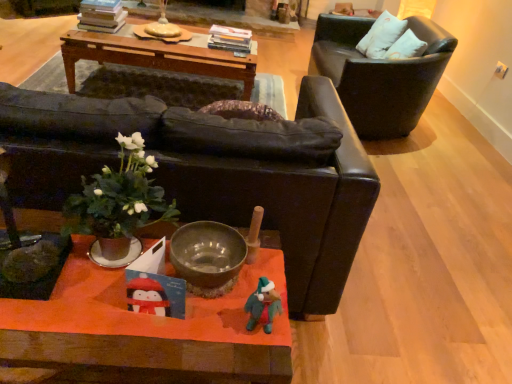
Locate an element on the screen. vacant space situated on the left part of felt-like green toy at lower center is located at coordinates (198, 338).